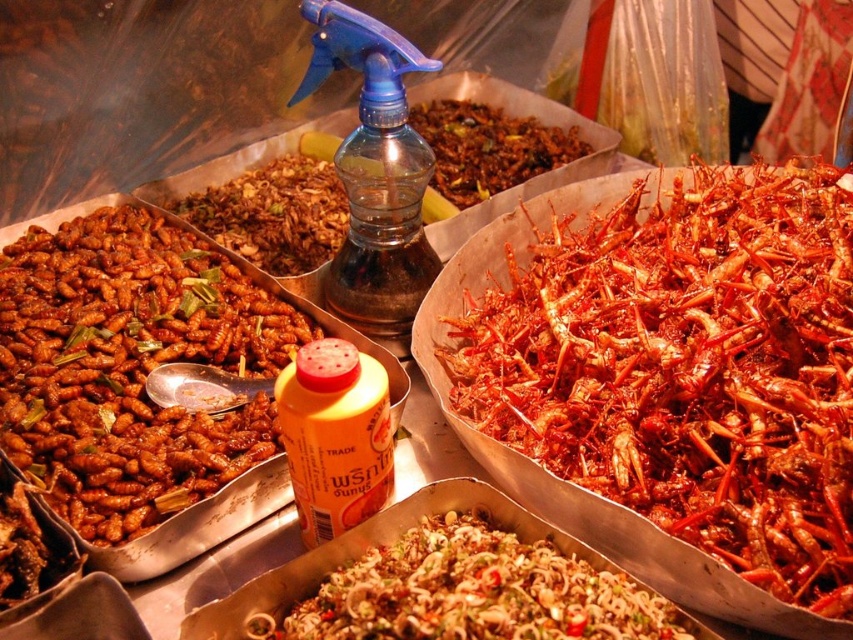
Can you confirm if yellow plastic bottle at center is smaller than brown crispy insects at center?

Indeed, yellow plastic bottle at center has a smaller size compared to brown crispy insects at center.

Is point (352, 474) positioned after point (207, 198)?

No.

At what (x,y) coordinates should I click in order to perform the action: click on yellow plastic bottle at center. Please return your answer as a coordinate pair (x, y). Looking at the image, I should click on (335, 436).

Between translucent plastic bottle at center and yellow plastic bottle at center, which one is positioned lower?

yellow plastic bottle at center is below.

Is point (213, 205) farther from camera compared to point (372, 410)?

Yes.

Is point (289, 253) less distant than point (285, 390)?

No, it is behind (285, 390).

Where is `translucent plastic bottle at center`? This screenshot has width=853, height=640. translucent plastic bottle at center is located at coordinates (274, 212).

Is brown matte insects at left above shiny green salad at center?

Yes.

Does brown matte insects at left lie in front of shiny green salad at center?

No, it is not.

Locate an element on the screen. This screenshot has width=853, height=640. brown matte insects at left is located at coordinates (131, 365).